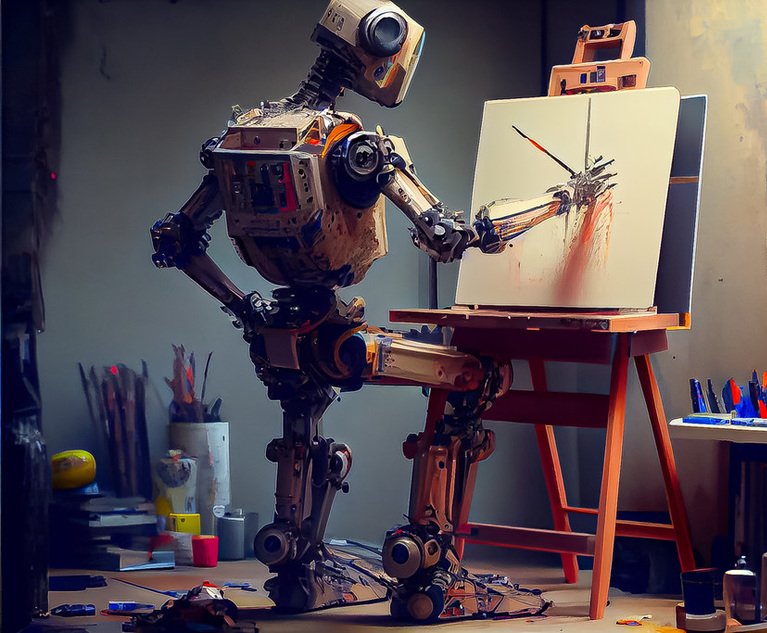
Locate an element on the screen. This screenshot has height=633, width=767. red pot is located at coordinates (203, 548).